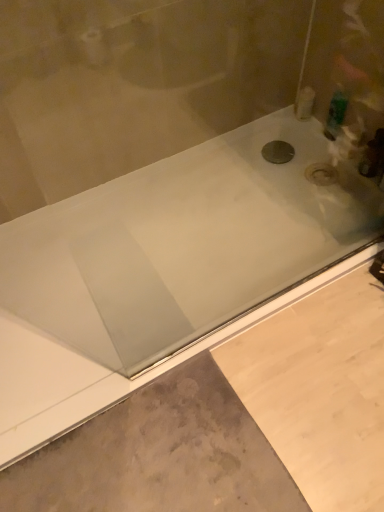
Where is `vacant space in front of black metallic drain at center`? This screenshot has height=512, width=384. vacant space in front of black metallic drain at center is located at coordinates (284, 186).